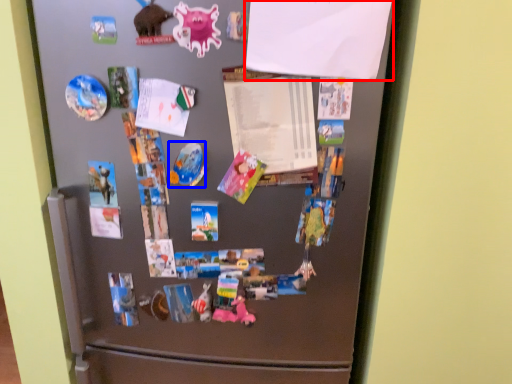
Question: Which object is closer to the camera taking this photo, paper (highlighted by a red box) or art (highlighted by a blue box)?

Choices:
 (A) paper
 (B) art

Answer: (A)